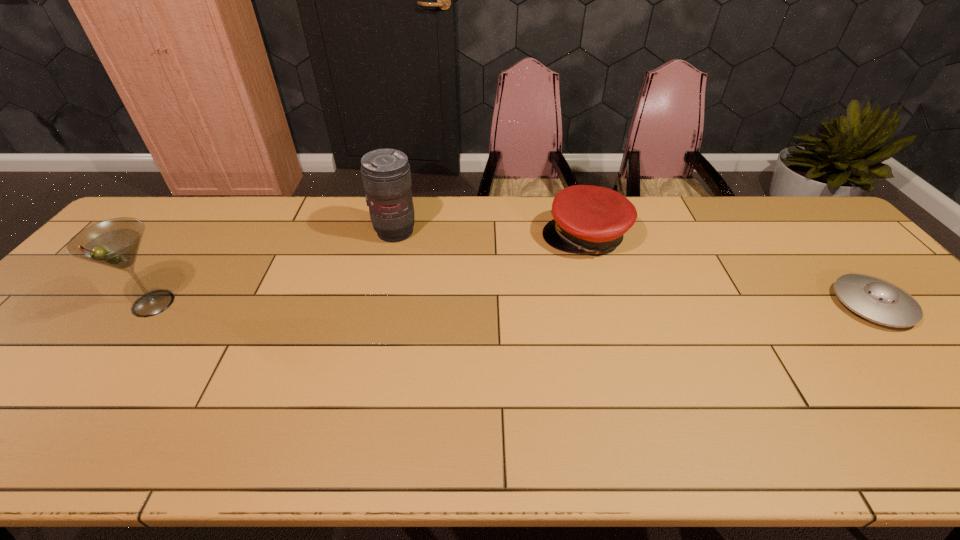
Locate an element on the screen. Image resolution: width=960 pixels, height=540 pixels. the leftmost object is located at coordinates (115, 242).

Locate an element on the screen. This screenshot has height=540, width=960. saucer is located at coordinates (875, 299).

This screenshot has height=540, width=960. I want to click on the shortest object, so click(x=875, y=299).

Locate an element on the screen. The image size is (960, 540). the second object from right to left is located at coordinates (592, 219).

You are a GUI agent. You are given a task and a screenshot of the screen. Output one action in this format:
    pyautogui.click(x=<x>, y=<y>)
    Task: Click on the second shortest object
    This screenshot has width=960, height=540.
    Given the screenshot: What is the action you would take?
    pyautogui.click(x=592, y=219)

This screenshot has height=540, width=960. Identify the location of telephoto lens. (386, 175).

Identify the location of free space located 0.240m on the back of the leftmost object. The width and height of the screenshot is (960, 540). (207, 231).

Image resolution: width=960 pixels, height=540 pixels. I want to click on blank space located 0.200m on the left of the shortest object, so click(759, 305).

You are a GUI agent. You are given a task and a screenshot of the screen. Output one action in this format:
    pyautogui.click(x=<x>, y=<y>)
    Task: Click on the vacant space located at the front of the second object from right to left where the visor is located
    The width and height of the screenshot is (960, 540).
    Given the screenshot: What is the action you would take?
    pyautogui.click(x=542, y=265)

The height and width of the screenshot is (540, 960). Identify the location of free location located 0.150m at the front of the second object from right to left where the visor is located. (523, 278).